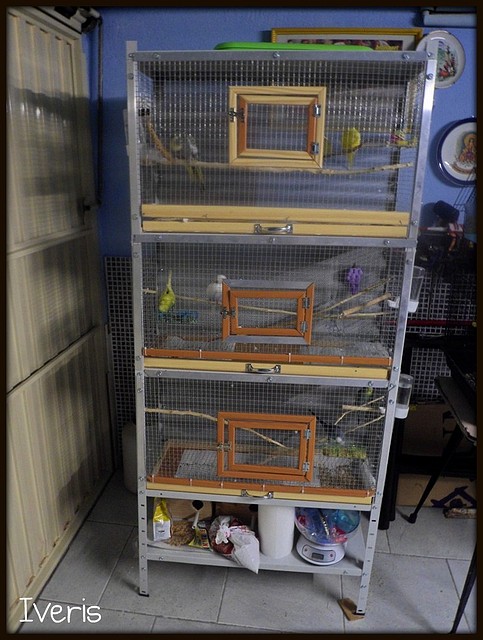
You are a GUI agent. You are given a task and a screenshot of the screen. Output one action in this format:
    pyautogui.click(x=<x>, y=<y>)
    Task: Click on the wall
    
    Given the screenshot: What is the action you would take?
    pyautogui.click(x=453, y=102)